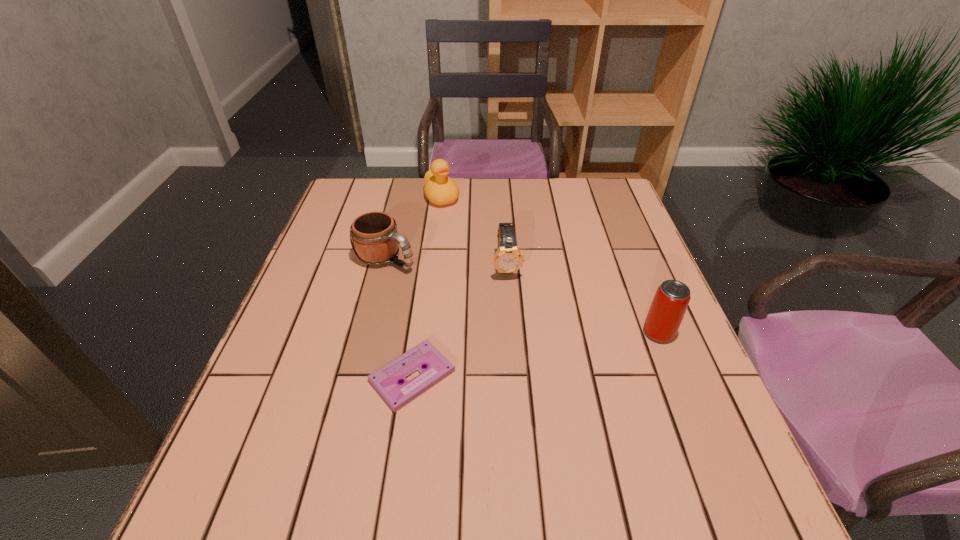
Where is `the shortest object`? This screenshot has height=540, width=960. the shortest object is located at coordinates (386, 380).

I want to click on beer can, so click(672, 297).

Locate an element on the screen. mug is located at coordinates (375, 240).

What are the coordinates of `watch` in the screenshot? It's located at click(x=508, y=258).

Identify the location of duck. The width and height of the screenshot is (960, 540). (439, 189).

At what (x,y) coordinates should I click in order to perform the action: click on vacant point located 0.290m on the right of the shortest object. Please return your answer as a coordinate pair (x, y). Image resolution: width=960 pixels, height=540 pixels. Looking at the image, I should click on (600, 376).

Locate an element on the screen. The width and height of the screenshot is (960, 540). free space located on the front of the beer can is located at coordinates (708, 458).

Identify the location of free region located 0.380m on the side of the mug with the handle. The image size is (960, 540). (539, 336).

At what (x,y) coordinates should I click in order to perform the action: click on vacant space situated 0.280m on the side of the mug with the handle. Please return your answer as a coordinate pair (x, y). Looking at the image, I should click on (500, 316).

Find the location of a particular element. vacant space located on the side of the mug with the handle is located at coordinates (449, 289).